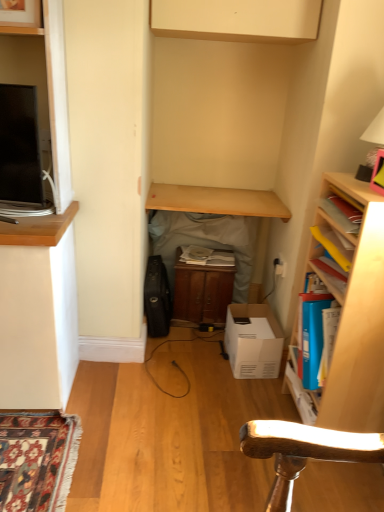
What is the approximate width of light wood table at center, which ranks as the second table in bottom-to-top order?

45.15 centimeters.

What do you see at coordinates (202, 293) in the screenshot? The width and height of the screenshot is (384, 512). I see `wooden cabinet at center` at bounding box center [202, 293].

What do you see at coordinates (375, 130) in the screenshot? I see `white matte lampshade at upper right` at bounding box center [375, 130].

Where is `white plastic electric outlet at center-right`? white plastic electric outlet at center-right is located at coordinates (280, 266).

Describe the element at coordinates (237, 20) in the screenshot. The width and height of the screenshot is (384, 512). I see `matte white cabinet at upper center` at that location.

At what (x,y) coordinates should I click in order to perform the action: click on light wood table at center, the first table viewed from the top. Please return your answer as a coordinate pair (x, y). Looking at the image, I should click on (216, 201).

Is white plastic electric outlet at center-right positioned far away from white matte lampshade at upper right?

That's not correct — white plastic electric outlet at center-right is a little close to white matte lampshade at upper right.

Which of these two, white plastic electric outlet at center-right or white matte lampshade at upper right, is bigger?

white matte lampshade at upper right is bigger.

How much distance is there between white plastic electric outlet at center-right and white matte lampshade at upper right?

white plastic electric outlet at center-right is 31.66 inches from white matte lampshade at upper right.

Which is correct: white plastic electric outlet at center-right is inside white matte lampshade at upper right, or outside of it?

white plastic electric outlet at center-right is located beyond the bounds of white matte lampshade at upper right.

Can you confirm if wooden cabinet at center is thinner than white matte lampshade at upper right?

No, wooden cabinet at center is not thinner than white matte lampshade at upper right.

From a real-world perspective, is wooden cabinet at center above or below white matte lampshade at upper right?

From a real-world perspective, wooden cabinet at center is physically below white matte lampshade at upper right.

Is wooden cabinet at center shorter than white matte lampshade at upper right?

Incorrect, the height of wooden cabinet at center does not fall short of that of white matte lampshade at upper right.

Can you confirm if wooden cabinet at center is smaller than white matte lampshade at upper right?

Incorrect, wooden cabinet at center is not smaller in size than white matte lampshade at upper right.

Is there a large distance between wooden cabinet at center, marked as the 2th table in a top-to-bottom arrangement, and light wood table at center, which ranks as the second table in bottom-to-top order?

wooden cabinet at center, marked as the 2th table in a top-to-bottom arrangement, is near light wood table at center, which ranks as the second table in bottom-to-top order, not far away.

From the picture: Could you tell me if wooden cabinet at center, placed as the 1th table when sorted from bottom to top, is facing light wood table at center, the first table viewed from the top?

No, wooden cabinet at center, placed as the 1th table when sorted from bottom to top, is not oriented towards light wood table at center, the first table viewed from the top.

From a real-world perspective, who is located higher, wooden cabinet at center, marked as the 2th table in a top-to-bottom arrangement, or light wood table at center, the first table viewed from the top?

light wood table at center, the first table viewed from the top.

Could you measure the distance between wooden cabinet at center, placed as the 1th table when sorted from bottom to top, and light wood table at center, the first table viewed from the top?

They are 1.99 inches apart.

Looking at their sizes, would you say wooden cabinet at center, marked as the 2th table in a top-to-bottom arrangement, is wider or thinner than white matte lampshade at upper right?

Clearly, wooden cabinet at center, marked as the 2th table in a top-to-bottom arrangement, has more width compared to white matte lampshade at upper right.

Between wooden cabinet at center, placed as the 1th table when sorted from bottom to top, and white matte lampshade at upper right, which one appears on the left side from the viewer's perspective?

Positioned to the left is wooden cabinet at center, placed as the 1th table when sorted from bottom to top.

Between wooden cabinet at center, marked as the 2th table in a top-to-bottom arrangement, and white matte lampshade at upper right, which one has less height?

white matte lampshade at upper right.

From a real-world perspective, which object rests below the other?

In real-world perspective, wooden cabinet at center, marked as the 2th table in a top-to-bottom arrangement, is lower.

Consider the image. Is wooden cabinet at center, placed as the 1th table when sorted from bottom to top, with white plastic electric outlet at center-right?

They are not placed beside each other.

Does wooden cabinet at center, placed as the 1th table when sorted from bottom to top, have a smaller size compared to white plastic electric outlet at center-right?

No.

In the scene shown: Which object is positioned more to the right, light wood table at center, the first table viewed from the top, or wooden bookshelf at right?

wooden bookshelf at right.

Who is more distant, light wood table at center, which ranks as the second table in bottom-to-top order, or wooden bookshelf at right?

light wood table at center, which ranks as the second table in bottom-to-top order, is behind.

From the image's perspective, is light wood table at center, which ranks as the second table in bottom-to-top order, under wooden bookshelf at right?

Actually, light wood table at center, which ranks as the second table in bottom-to-top order, appears above wooden bookshelf at right in the image.

Based on the photo, is light wood table at center, which ranks as the second table in bottom-to-top order, in contact with wooden bookshelf at right?

light wood table at center, which ranks as the second table in bottom-to-top order, is not next to wooden bookshelf at right, and they're not touching.

Is matte white cabinet at upper center far away from white cardboard box at center?

matte white cabinet at upper center is far away from white cardboard box at center.

Between matte white cabinet at upper center and white cardboard box at center, which one has more height?

With more height is white cardboard box at center.

The height and width of the screenshot is (512, 384). Find the location of `cabinetry that appears on the left of white cardboard box at center`. cabinetry that appears on the left of white cardboard box at center is located at coordinates (237, 20).

From the image's perspective, which one is positioned lower, matte white cabinet at upper center or white cardboard box at center?

white cardboard box at center, from the image's perspective.

Find the location of a particular element. lamp in front of the white plastic electric outlet at center-right is located at coordinates (375, 130).

You are a GUI agent. You are given a task and a screenshot of the screen. Output one action in this format:
    pyautogui.click(x=<x>, y=<y>)
    Task: Click on the drawer behind the white matte lampshade at upper right
    The height and width of the screenshot is (512, 384).
    Given the screenshot: What is the action you would take?
    pyautogui.click(x=202, y=293)

Considering their positions, is white cardboard box at center positioned further to white plastic electric outlet at center-right than wooden cabinet at center, placed as the 1th table when sorted from bottom to top?

wooden cabinet at center, placed as the 1th table when sorted from bottom to top.

Considering their positions, is matte white cabinet at upper center positioned closer to wooden bookshelf at right than white matte lampshade at upper right?

Based on the image, white matte lampshade at upper right appears to be nearer to wooden bookshelf at right.

Estimate the real-world distances between objects in this image. Which object is further from white plastic electric outlet at center-right, wooden bookshelf at right or matte white cabinet at upper center?

matte white cabinet at upper center.

Considering their positions, is wooden cabinet at center positioned closer to wooden cabinet at center, marked as the 2th table in a top-to-bottom arrangement, than white matte lampshade at upper right?

wooden cabinet at center.

Considering their positions, is white cardboard box at center positioned further to matte white cabinet at upper center than white matte lampshade at upper right?

Based on the image, white cardboard box at center appears to be further to matte white cabinet at upper center.

Based on their spatial positions, is light wood table at center, the first table viewed from the top, or wooden cabinet at center, placed as the 1th table when sorted from bottom to top, further from wooden bookshelf at right?

wooden cabinet at center, placed as the 1th table when sorted from bottom to top.

Considering their positions, is wooden cabinet at center, placed as the 1th table when sorted from bottom to top, positioned further to white matte lampshade at upper right than white plastic electric outlet at center-right?

wooden cabinet at center, placed as the 1th table when sorted from bottom to top, lies further to white matte lampshade at upper right than the other object.

Which object lies nearer to the anchor point white matte lampshade at upper right, wooden cabinet at center or wooden bookshelf at right?

wooden bookshelf at right is closer to white matte lampshade at upper right.

Locate an element on the screen. Image resolution: width=384 pixels, height=512 pixels. cardboard box between white matte lampshade at upper right and wooden cabinet at center in the front-back direction is located at coordinates (253, 341).

Find the location of a particular element. The image size is (384, 512). lamp between matte white cabinet at upper center and light wood table at center, which ranks as the second table in bottom-to-top order, in the up-down direction is located at coordinates (375, 130).

This screenshot has width=384, height=512. In order to click on lamp between matte white cabinet at upper center and wooden cabinet at center vertically in this screenshot , I will do `click(375, 130)`.

This screenshot has height=512, width=384. I want to click on cardboard box between white matte lampshade at upper right and wooden cabinet at center, placed as the 1th table when sorted from bottom to top, from front to back, so click(253, 341).